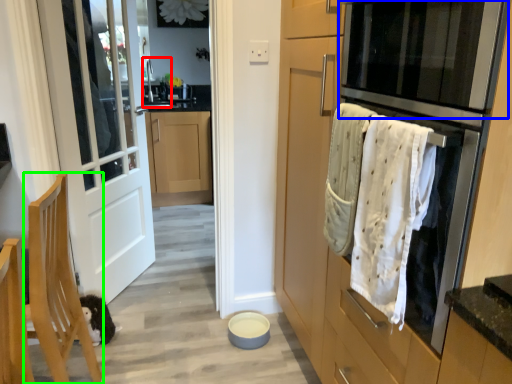
Question: Which object is the closest to the sink (highlighted by a red box)? Choose among these: oven (highlighted by a blue box) or chair (highlighted by a green box).

Choices:
 (A) oven
 (B) chair

Answer: (B)